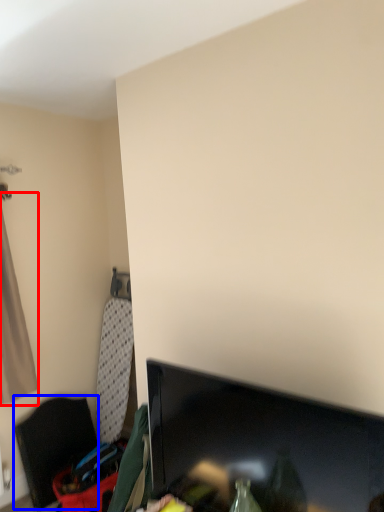
Question: Which object is further to the camera taking this photo, curtain (highlighted by a red box) or furniture (highlighted by a blue box)?

Choices:
 (A) curtain
 (B) furniture

Answer: (B)